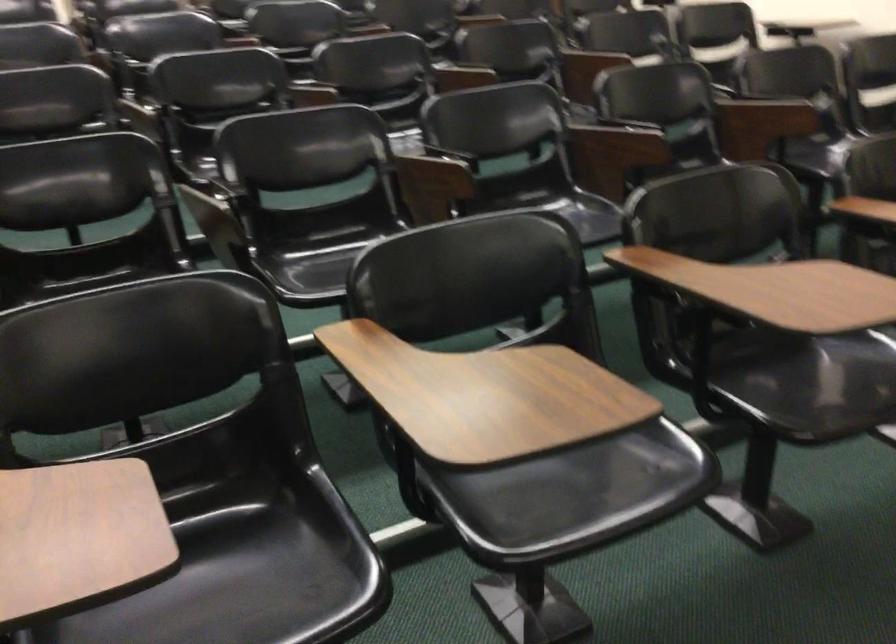
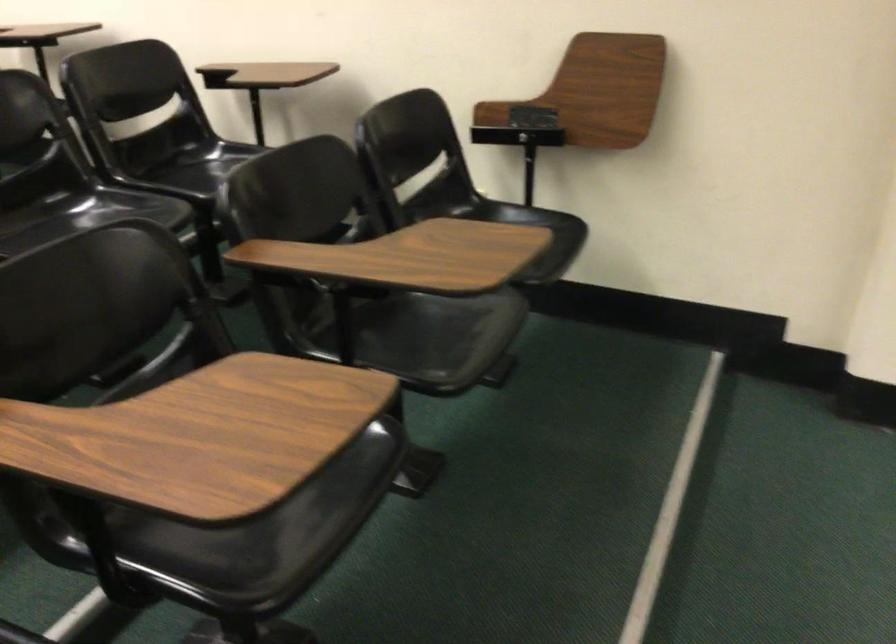
Question: The images are taken continuously from a first-person perspective. In which direction is your viewpoint rotating?

Choices:
 (A) Left
 (B) Right
 (C) Up
 (D) Down

Answer: (B)